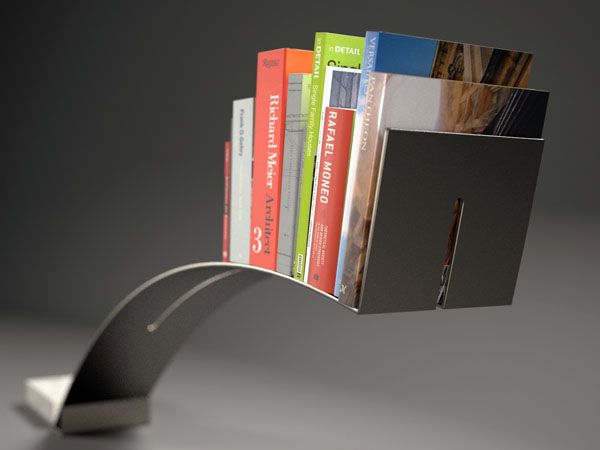
Locate an element on the screen. The height and width of the screenshot is (450, 600). books is located at coordinates (229, 192), (241, 196), (259, 194), (296, 196), (308, 197), (330, 197), (350, 200), (366, 191).